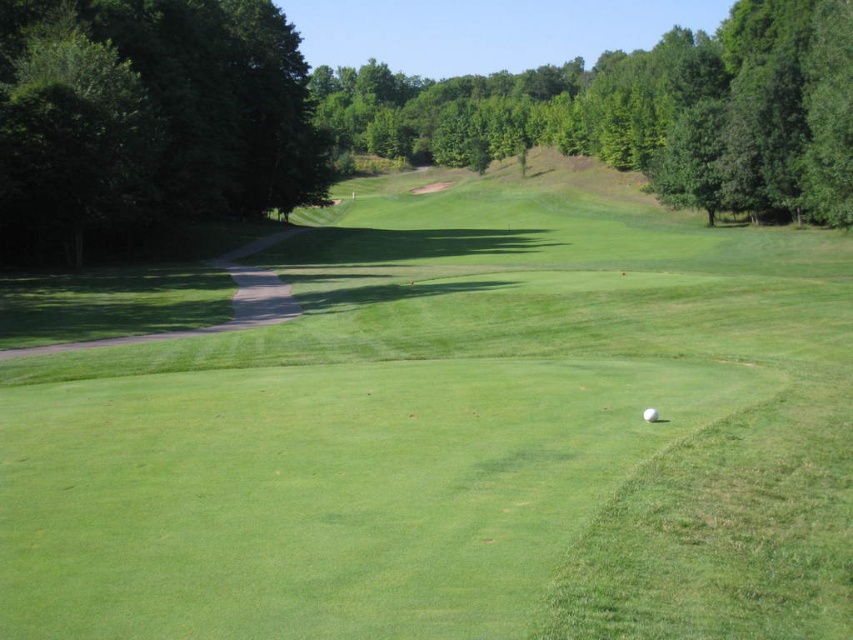
Does green leafy tree at left appear on the left side of white matte golf ball at center?

Indeed, green leafy tree at left is positioned on the left side of white matte golf ball at center.

Who is higher up, green leafy tree at left or white matte golf ball at center?

Positioned higher is green leafy tree at left.

Describe the element at coordinates (148, 116) in the screenshot. I see `green leafy tree at left` at that location.

Locate an element on the screen. green leafy tree at left is located at coordinates (148, 116).

Can you confirm if green leafy tree at left is positioned to the left of green leafy tree at upper center?

Correct, you'll find green leafy tree at left to the left of green leafy tree at upper center.

Can you confirm if green leafy tree at left is positioned above green leafy tree at upper center?

Actually, green leafy tree at left is below green leafy tree at upper center.

Measure the distance between point [28,243] and camera.

58.79 meters

Locate an element on the screen. green leafy tree at left is located at coordinates [x=148, y=116].

Between green leafy tree at upper center and white matte golf ball at center, which one is positioned lower?

white matte golf ball at center

Is green leafy tree at upper center wider than white matte golf ball at center?

Yes.

Who is more forward, (618, 115) or (653, 417)?

Point (653, 417) is more forward.

Find the location of a particular element. green leafy tree at upper center is located at coordinates (646, 112).